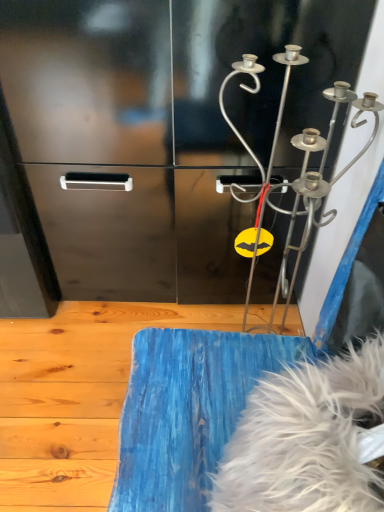
Question: Can you confirm if blue painted wood at lower center is positioned to the left of silver metallic wind chime at upper right?

Choices:
 (A) no
 (B) yes

Answer: (B)

Question: Does blue painted wood at lower center turn towards silver metallic wind chime at upper right?

Choices:
 (A) no
 (B) yes

Answer: (A)

Question: Is blue painted wood at lower center oriented away from silver metallic wind chime at upper right?

Choices:
 (A) no
 (B) yes

Answer: (A)

Question: Is blue painted wood at lower center surrounding silver metallic wind chime at upper right?

Choices:
 (A) yes
 (B) no

Answer: (B)

Question: Does blue painted wood at lower center have a lesser height compared to silver metallic wind chime at upper right?

Choices:
 (A) no
 (B) yes

Answer: (B)

Question: From the image's perspective, relative to blue painted wood at lower center, is silver metallic wind chime at upper right above or below?

Choices:
 (A) above
 (B) below

Answer: (A)

Question: Is silver metallic wind chime at upper right in front of or behind blue painted wood at lower center in the image?

Choices:
 (A) front
 (B) behind

Answer: (A)

Question: From a real-world perspective, is silver metallic wind chime at upper right positioned above or below blue painted wood at lower center?

Choices:
 (A) below
 (B) above

Answer: (B)

Question: In terms of width, does silver metallic wind chime at upper right look wider or thinner when compared to blue painted wood at lower center?

Choices:
 (A) wide
 (B) thin

Answer: (B)

Question: Is point click(21, 483) positioned closer to the camera than point click(240, 478)?

Choices:
 (A) closer
 (B) farther

Answer: (B)

Question: From the image's perspective, is blue painted wood at lower center located above or below white fluffy feather at lower right?

Choices:
 (A) above
 (B) below

Answer: (B)

Question: Would you say blue painted wood at lower center is inside or outside white fluffy feather at lower right?

Choices:
 (A) inside
 (B) outside

Answer: (B)

Question: Would you say blue painted wood at lower center is to the left or to the right of white fluffy feather at lower right in the picture?

Choices:
 (A) left
 (B) right

Answer: (A)

Question: Based on their sizes in the image, would you say blue painted wood at lower center is bigger or smaller than silver metallic wind chime at upper right?

Choices:
 (A) big
 (B) small

Answer: (B)

Question: Is blue painted wood at lower center inside or outside of silver metallic wind chime at upper right?

Choices:
 (A) outside
 (B) inside

Answer: (A)